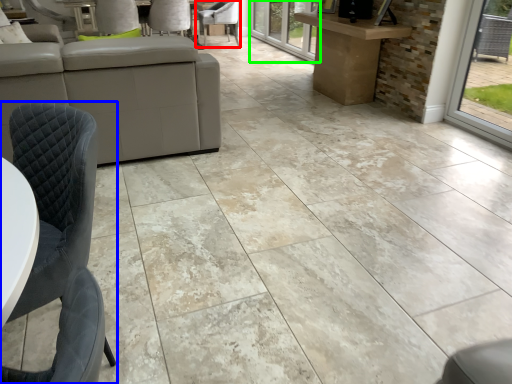
Question: Considering the real-world distances, which object is closest to chair (highlighted by a red box)? chair (highlighted by a blue box) or glass door (highlighted by a green box).

Choices:
 (A) chair
 (B) glass door

Answer: (B)